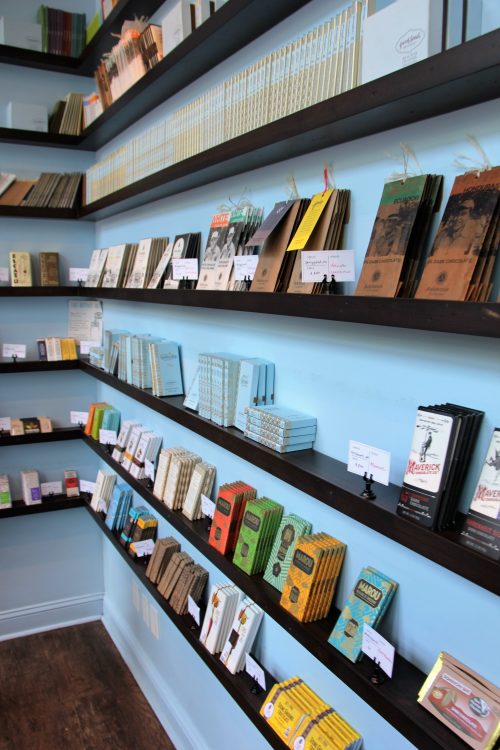
This screenshot has height=750, width=500. In order to click on shelves in this screenshot , I will do `click(160, 592)`, `click(222, 562)`, `click(286, 465)`, `click(303, 308)`, `click(277, 140)`, `click(218, 32)`, `click(113, 14)`.